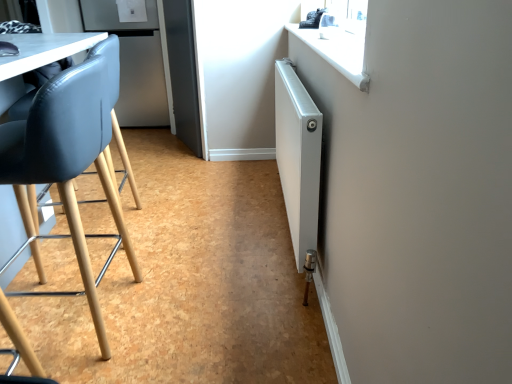
Where is `vacant region to the left of white metallic radiator at right`? This screenshot has width=512, height=384. vacant region to the left of white metallic radiator at right is located at coordinates (192, 222).